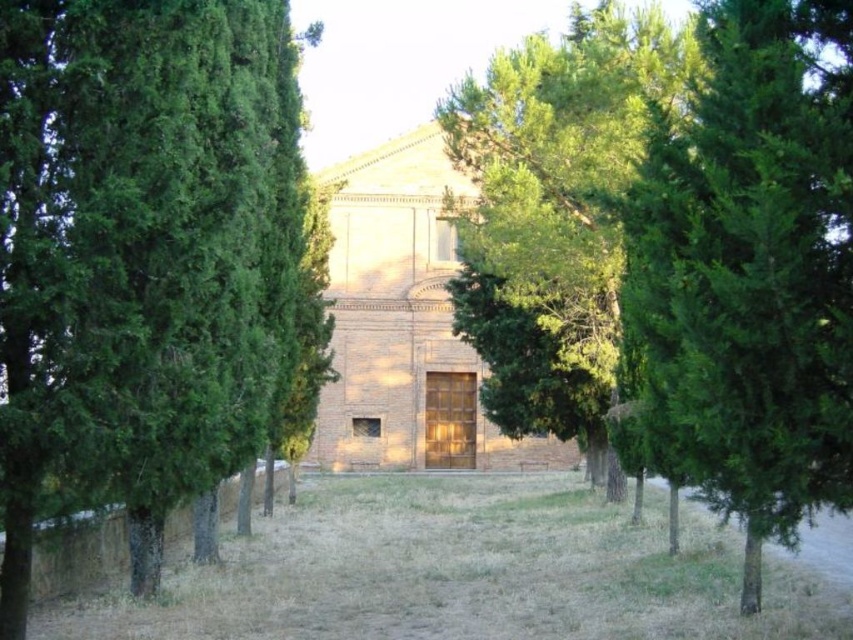
Between point (689, 346) and point (534, 76), which one is positioned in front?

Point (689, 346)

Can you confirm if green textured tree at center is thinner than green leafy tree at center?

Indeed, green textured tree at center has a lesser width compared to green leafy tree at center.

Find the location of a particular element. green textured tree at center is located at coordinates (749, 273).

Can you confirm if green textured tree at left is wider than dry grass at center?

In fact, green textured tree at left might be narrower than dry grass at center.

Can you confirm if green textured tree at left is bigger than dry grass at center?

Incorrect, green textured tree at left is not larger than dry grass at center.

Describe the element at coordinates (138, 252) in the screenshot. Image resolution: width=853 pixels, height=640 pixels. I see `green textured tree at left` at that location.

Where is `green textured tree at left`? green textured tree at left is located at coordinates (138, 252).

Can you confirm if green textured tree at left is positioned to the left of green textured tree at center?

Correct, you'll find green textured tree at left to the left of green textured tree at center.

Is point (161, 488) farther from camera compared to point (640, 209)?

No, (161, 488) is closer to viewer.

Identify the location of green textured tree at left. (138, 252).